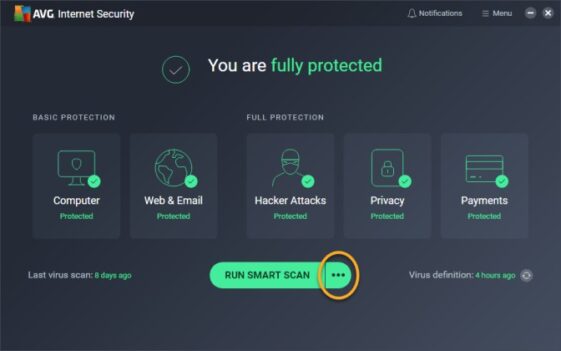
Identify the location of computer. The width and height of the screenshot is (561, 351). (68, 175).